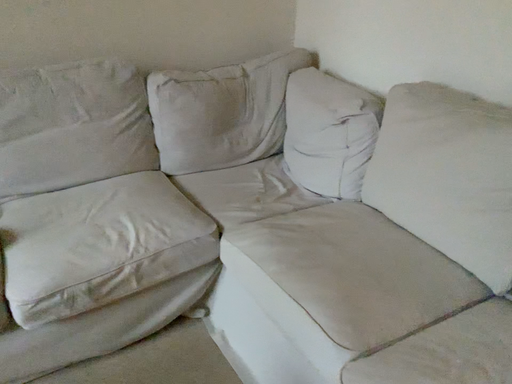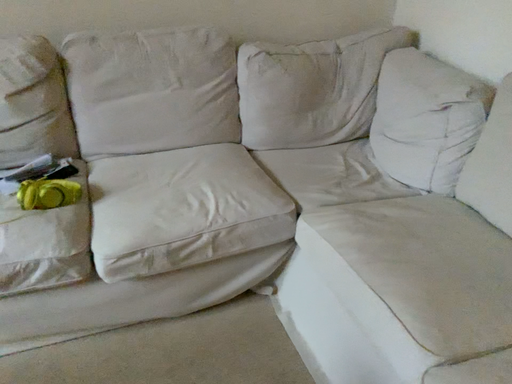
Question: How did the camera likely rotate when shooting the video?

Choices:
 (A) rotated left
 (B) rotated right

Answer: (A)